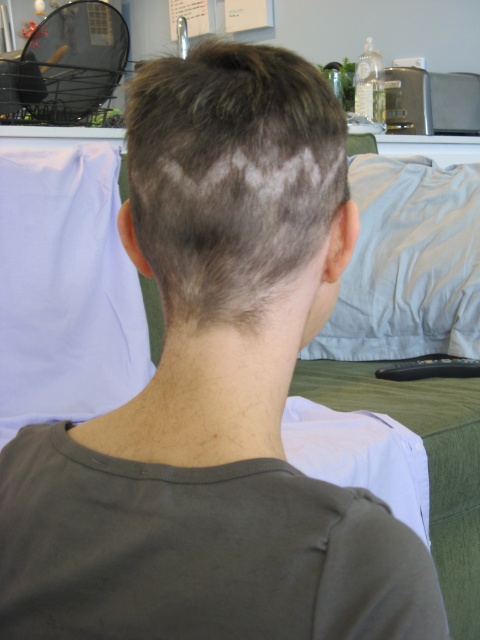
Question: Is dark brown hair at center to the left of black plastic remote at lower center from the viewer's perspective?

Choices:
 (A) no
 (B) yes

Answer: (B)

Question: Which point is closer to the camera?

Choices:
 (A) (434, 371)
 (B) (216, 209)

Answer: (B)

Question: Does dark brown hair at center appear under black plastic remote at lower center?

Choices:
 (A) no
 (B) yes

Answer: (A)

Question: Does dark brown hair at center come behind black plastic remote at lower center?

Choices:
 (A) yes
 (B) no

Answer: (B)